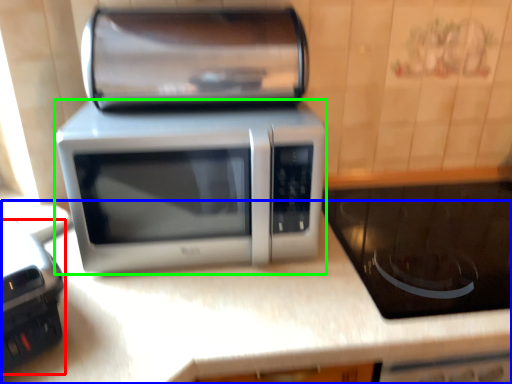
Question: Considering the real-world distances, which object is farthest from appliance (highlighted by a red box)? counter top (highlighted by a blue box) or microwave oven (highlighted by a green box)?

Choices:
 (A) counter top
 (B) microwave oven

Answer: (B)